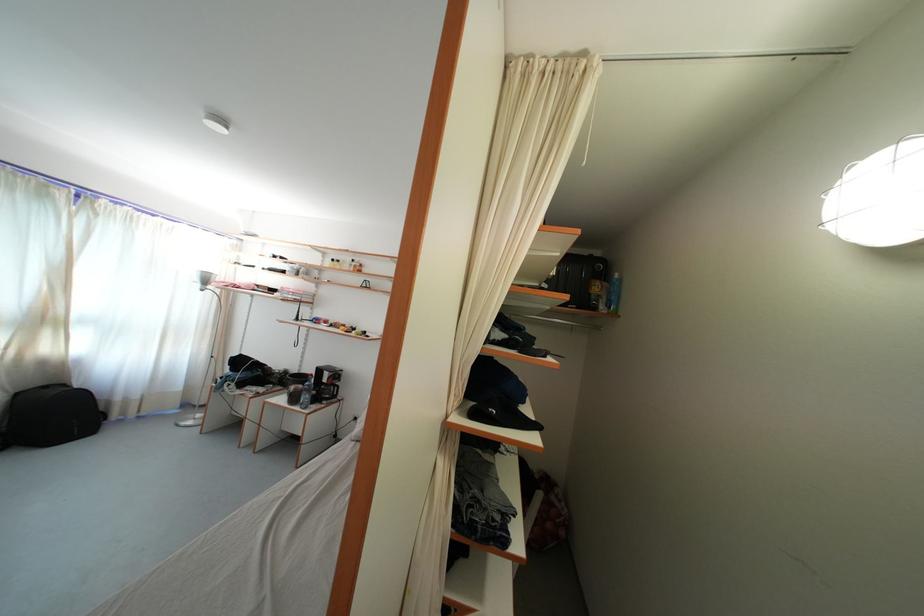
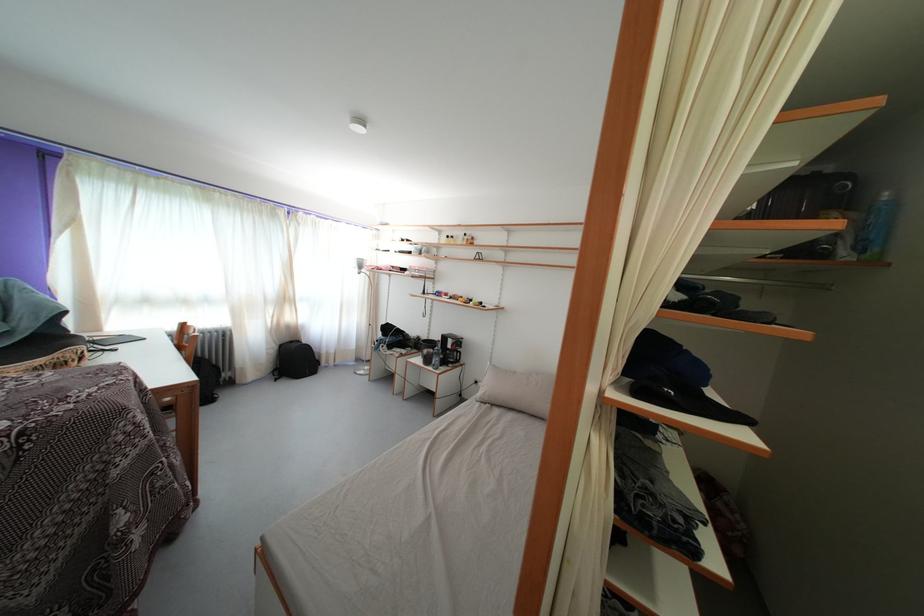
Question: What movement of the cameraman would produce the second image?

Choices:
 (A) Left
 (B) Right
 (C) Forward
 (D) Backward

Answer: (A)